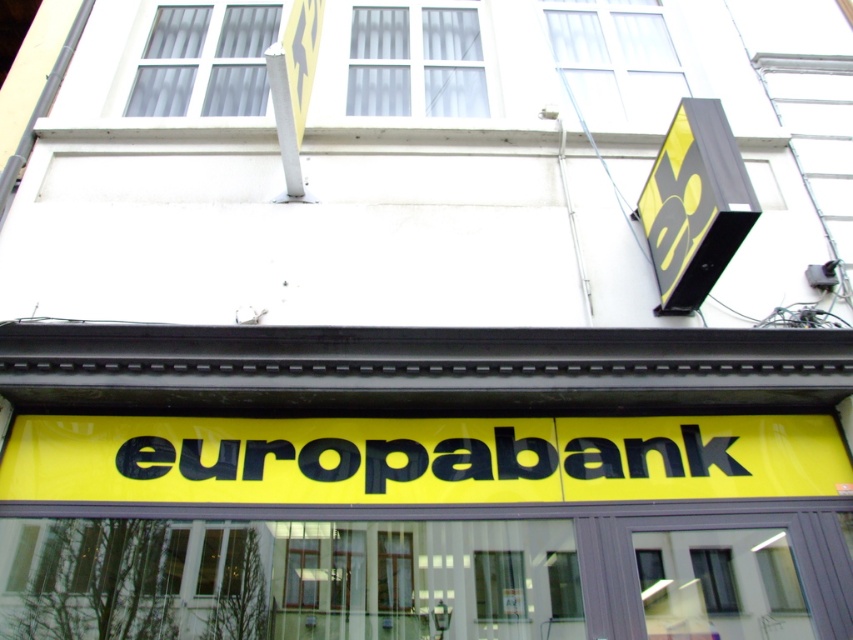
You are a GUI agent. You are given a task and a screenshot of the screen. Output one action in this format:
    pyautogui.click(x=<x>, y=<y>)
    Task: Click on the yellow matte/black sign at center
    
    Given the screenshot: What is the action you would take?
    pyautogui.click(x=392, y=465)

Looking at this image, is yellow matte/black sign at center to the right of transparent glass window at upper center from the viewer's perspective?

Incorrect, yellow matte/black sign at center is not on the right side of transparent glass window at upper center.

Locate an element on the screen. yellow matte/black sign at center is located at coordinates (x=392, y=465).

Between point (595, 17) and point (171, 61), which one is positioned behind?

Positioned behind is point (595, 17).

Based on the photo, can you confirm if transparent glass window at upper center is wider than clear glass window at upper center?

Indeed, transparent glass window at upper center has a greater width compared to clear glass window at upper center.

Does point (564, 61) come closer to viewer compared to point (231, 72)?

No, it is behind (231, 72).

Image resolution: width=853 pixels, height=640 pixels. Find the location of `transparent glass window at upper center`. transparent glass window at upper center is located at coordinates (616, 58).

Who is lower down, clear glass window at upper center or transparent glass window at center?

transparent glass window at center is lower down.

Is point (218, 90) closer to viewer compared to point (479, 611)?

No, it is not.

What do you see at coordinates (206, 61) in the screenshot? The width and height of the screenshot is (853, 640). I see `clear glass window at upper center` at bounding box center [206, 61].

Find the location of a particular element. The image size is (853, 640). clear glass window at upper center is located at coordinates (206, 61).